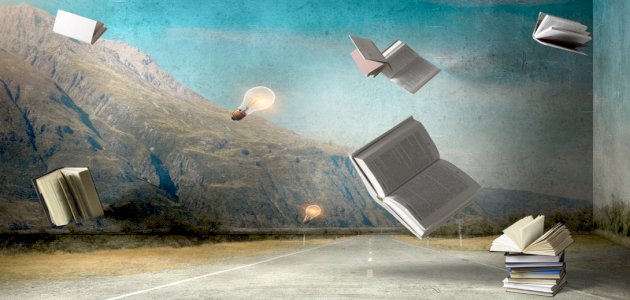
At what (x,y) coordinates should I click in order to perform the action: click on lightbulbs. Please return your answer as a coordinate pair (x, y). Looking at the image, I should click on (252, 102), (311, 213).